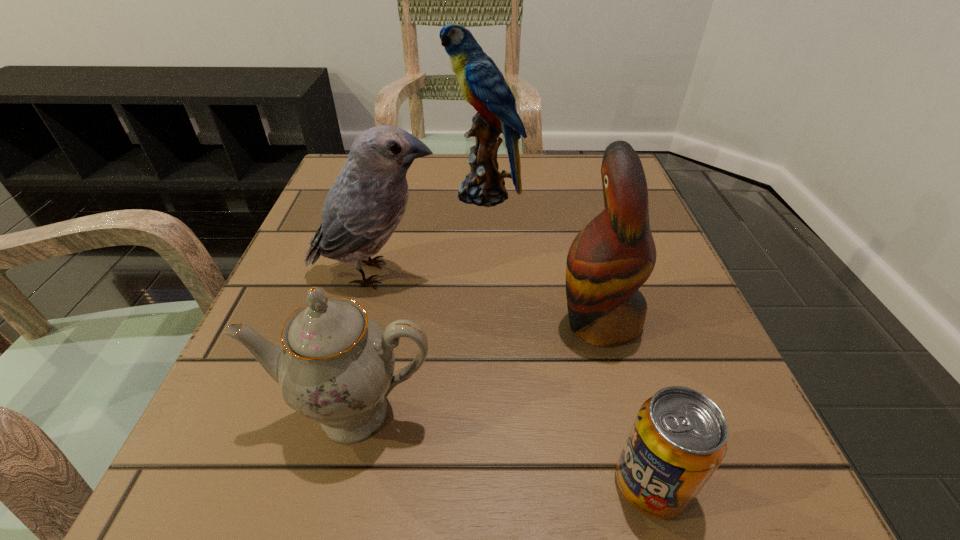
This screenshot has width=960, height=540. What are the coordinates of `the farthest object` in the screenshot? It's located at (483, 85).

This screenshot has width=960, height=540. I want to click on the rightmost parrot, so click(609, 260).

Locate an element on the screen. the nearest parrot is located at coordinates coord(609,260).

I want to click on the second nearest parrot, so click(x=364, y=206).

Find the location of a particular element. chinaware is located at coordinates (336, 367).

Find the location of a particular element. The height and width of the screenshot is (540, 960). soda can is located at coordinates (679, 437).

You are a GUI agent. You are given a task and a screenshot of the screen. Output one action in this format:
    pyautogui.click(x=<x>, y=<y>)
    Task: Click on the vacant space located on the face of the farthest parrot
    Image resolution: width=960 pixels, height=540 pixels.
    Given the screenshot: What is the action you would take?
    pyautogui.click(x=420, y=194)

Find the location of `vacant position located on the face of the farthest parrot`. vacant position located on the face of the farthest parrot is located at coordinates point(372,194).

This screenshot has width=960, height=540. Find the location of `free space located 0.150m on the face of the farthest parrot`. free space located 0.150m on the face of the farthest parrot is located at coordinates (380, 194).

Locate an element on the screen. free space located 0.090m on the face of the rightmost parrot is located at coordinates (500, 321).